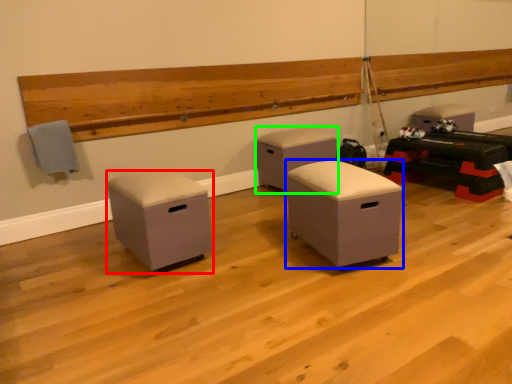
Question: Estimate the real-world distances between objects in this image. Which object is closer to furniture (highlighted by a red box), furniture (highlighted by a blue box) or furniture (highlighted by a green box)?

Choices:
 (A) furniture
 (B) furniture

Answer: (A)